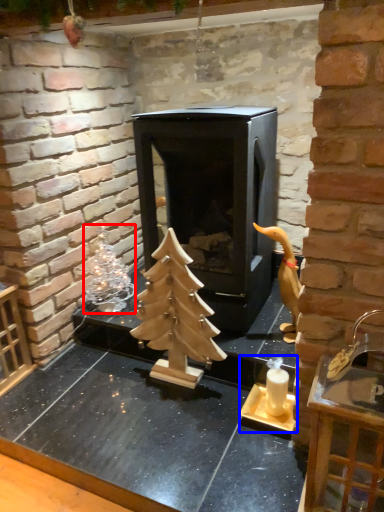
Question: Among these objects, which one is nearest to the camera, christmas decoration (highlighted by a red box) or candle holder (highlighted by a blue box)?

Choices:
 (A) christmas decoration
 (B) candle holder

Answer: (B)